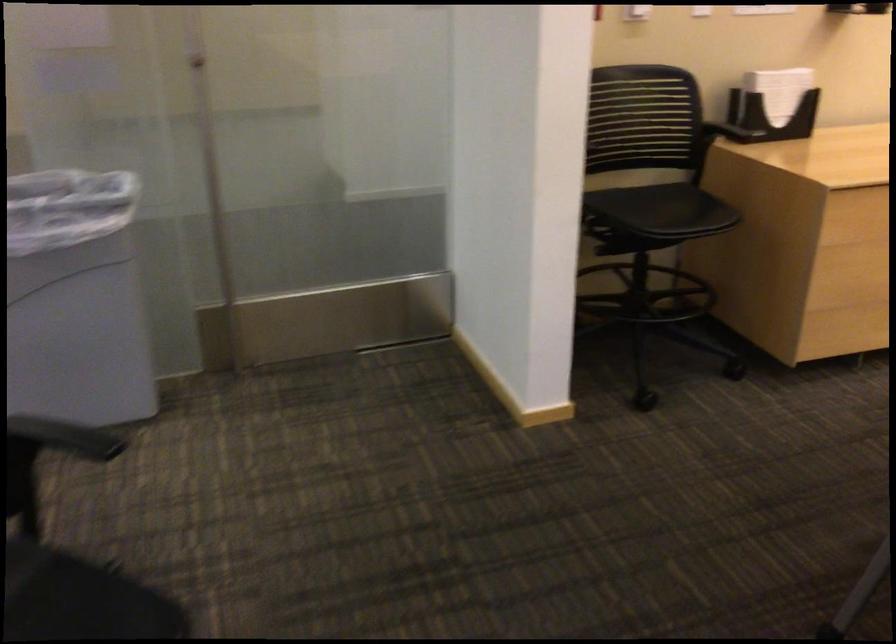
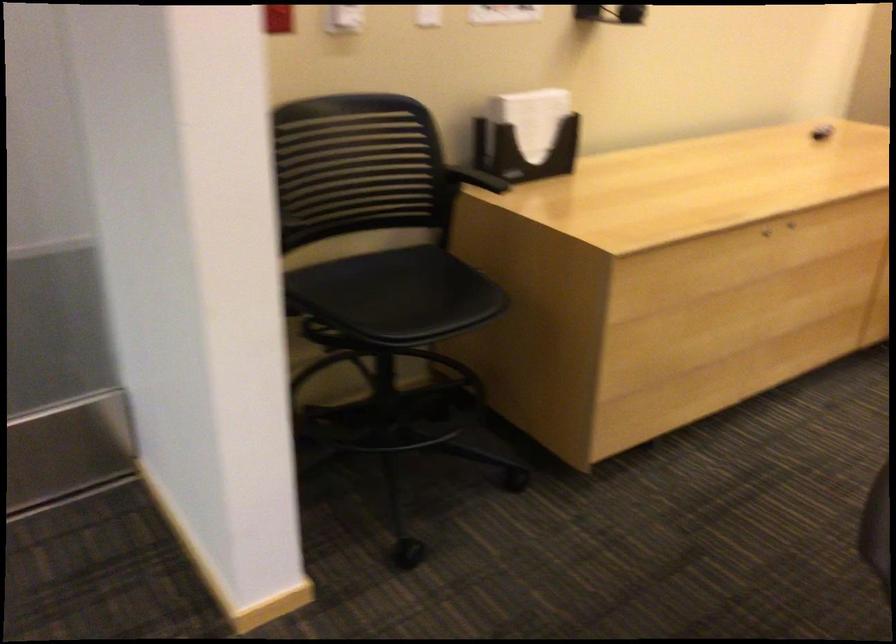
Question: The images are taken continuously from a first-person perspective. In which direction are you moving?

Choices:
 (A) Left
 (B) Right
 (C) Forward
 (D) Backward

Answer: (C)